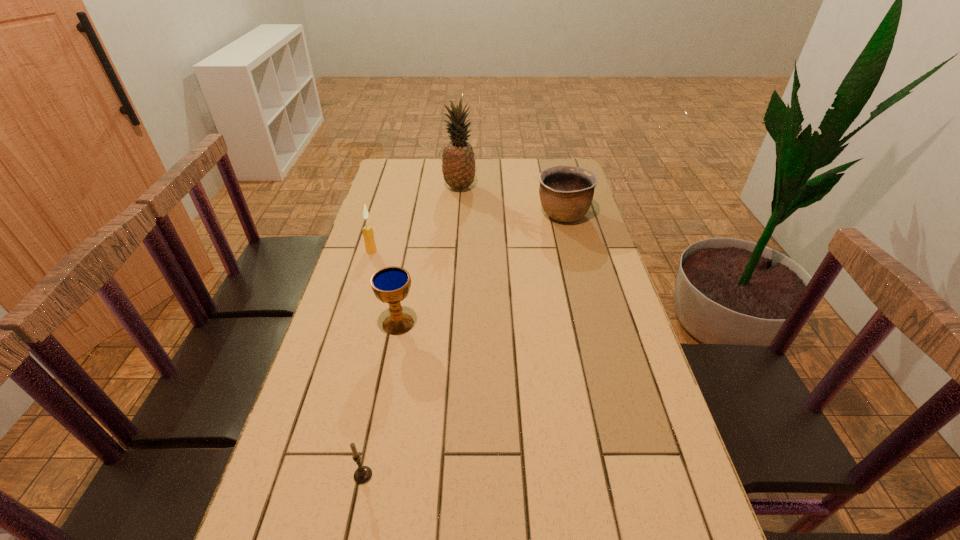
I want to click on pineapple, so click(458, 164).

The width and height of the screenshot is (960, 540). In order to click on the tallest object in this screenshot , I will do `click(458, 164)`.

I want to click on the third farthest object, so click(x=370, y=245).

Locate an element on the screen. the left candle is located at coordinates (370, 245).

I want to click on the second nearest object, so click(x=391, y=285).

Where is `pottery`? Image resolution: width=960 pixels, height=540 pixels. pottery is located at coordinates (566, 192).

This screenshot has width=960, height=540. What are the coordinates of `the second farthest object` in the screenshot? It's located at (566, 192).

You are a GUI agent. You are given a task and a screenshot of the screen. Output one action in this format:
    pyautogui.click(x=<x>, y=<y>)
    Task: Click on the shorter candle
    This screenshot has height=540, width=960.
    Given the screenshot: What is the action you would take?
    pyautogui.click(x=363, y=474)

You are a GUI agent. You are given a task and a screenshot of the screen. Output one action in this format:
    pyautogui.click(x=<x>, y=<y>)
    Task: Click on the right candle
    
    Given the screenshot: What is the action you would take?
    pyautogui.click(x=363, y=474)

I want to click on free location located on the right of the farthest object, so click(x=551, y=187).